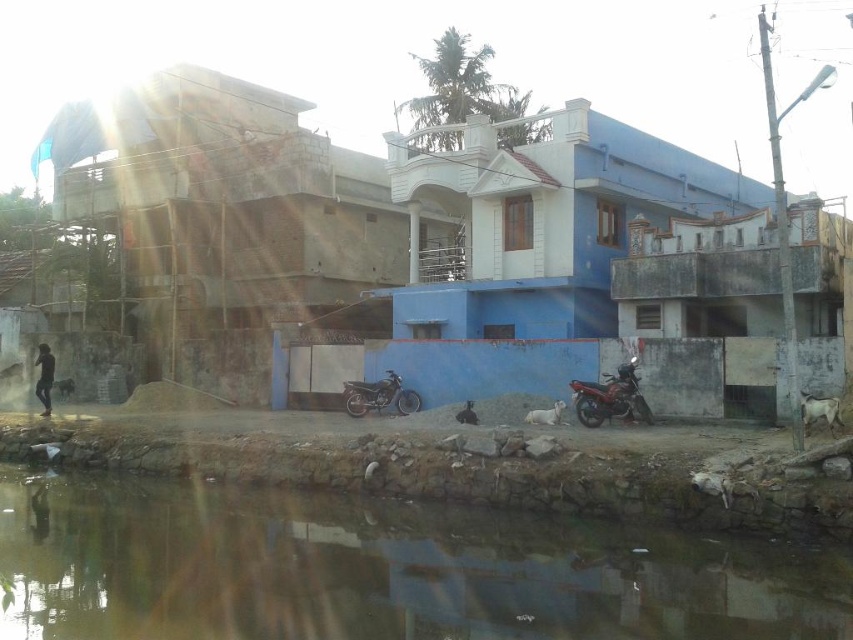
You are a delivery person who needs to park your vehicle in this area. You have a delivery van that is 2 meters wide. Can both the shiny red motorbike at lower right and the shiny metallic motorbike at center fit side by side in the parking space next to the light blue building with white accents?

The shiny red motorbike at lower right is narrower than the shiny metallic motorbike at center. Since the delivery van is 2 meters wide, and the combined width of both motorbikes would depend on their exact measurements, but since the red one is narrower, it might be possible if there is enough space. However, without knowing the exact widths of the motorbikes, we cannot definitively confirm if they can fit together in the parking space next to the light blue building with white accents.

You are standing at the center of the image and want to walk to the brown dirt river at lower center. According to the coordinates provided, in which direction should you move?

The brown dirt river at lower center is located at coordinates point (381, 570), so you should move towards the lower right direction to reach it.

You are standing on the sidewalk and see the brown dirt river at lower center and the shiny metallic motorbike at center. Which object is closer to your feet?

The brown dirt river at lower center is closer to your feet since it is positioned below the shiny metallic motorbike at center.